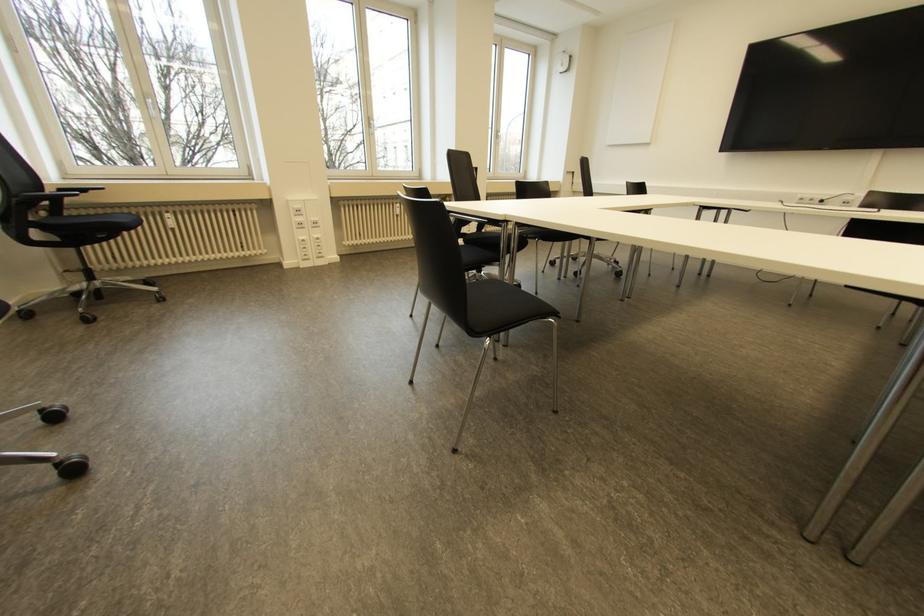
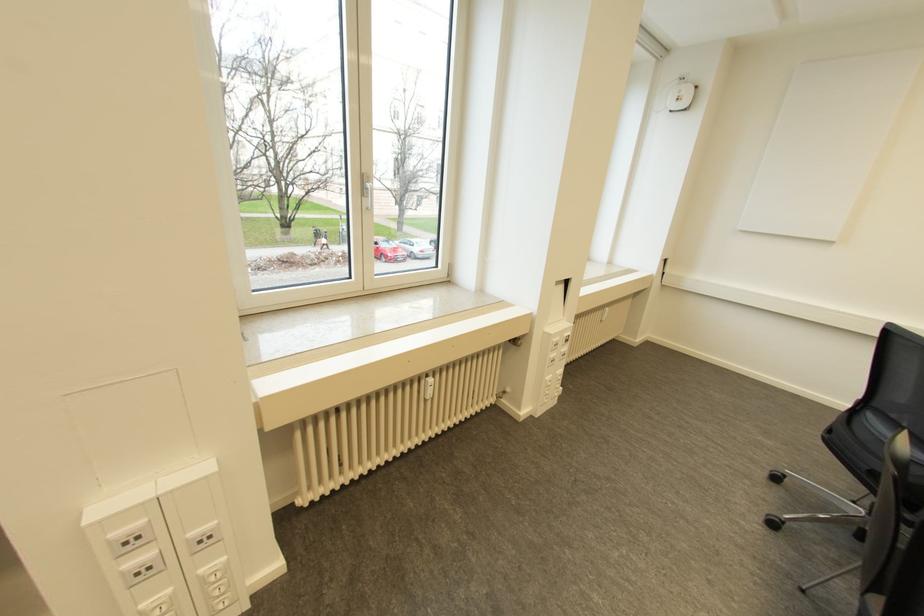
In a continuous first-person perspective shot, in which direction is the camera moving?

The cameraman walked toward left, forward.